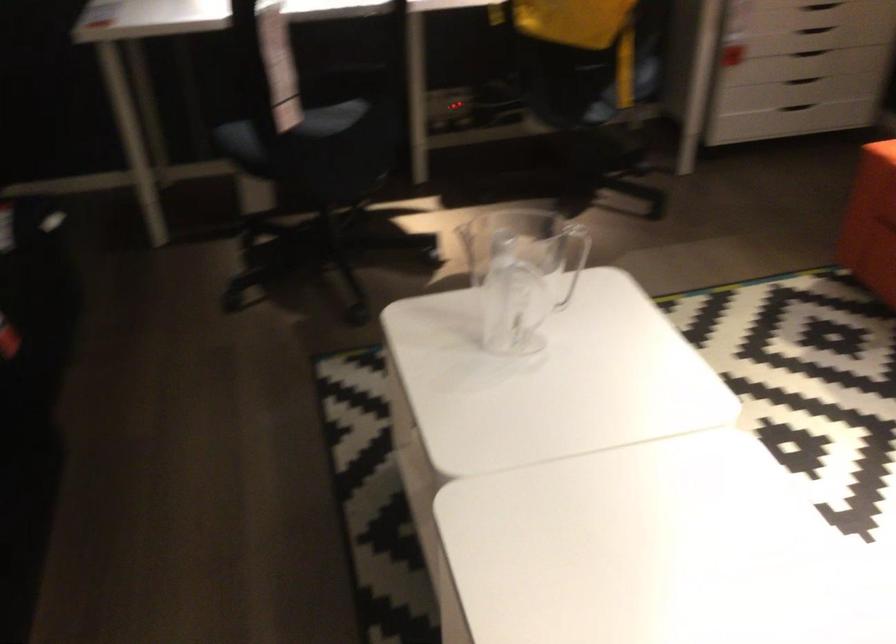
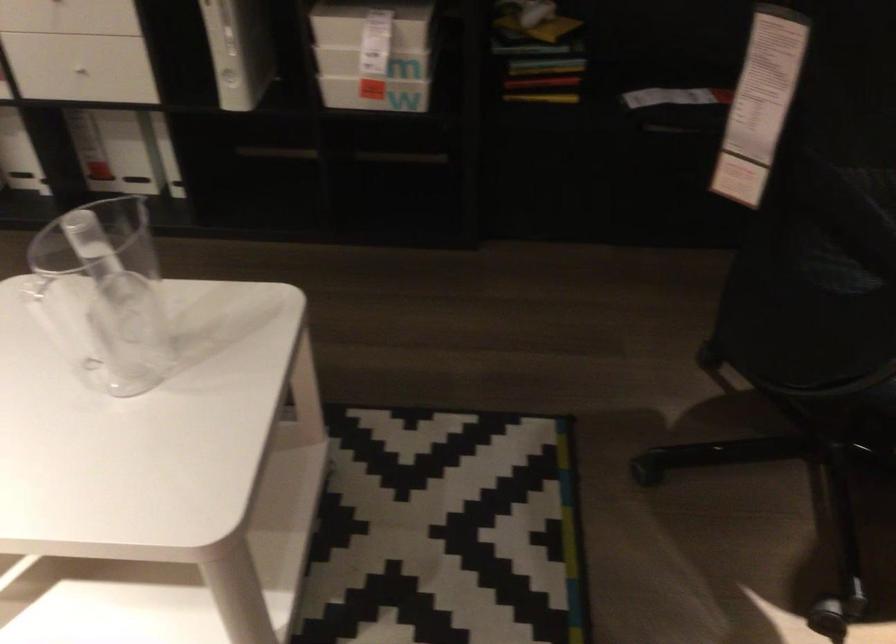
Find the pixel in the second image that matches (x=375, y=147) in the first image.

(837, 364)